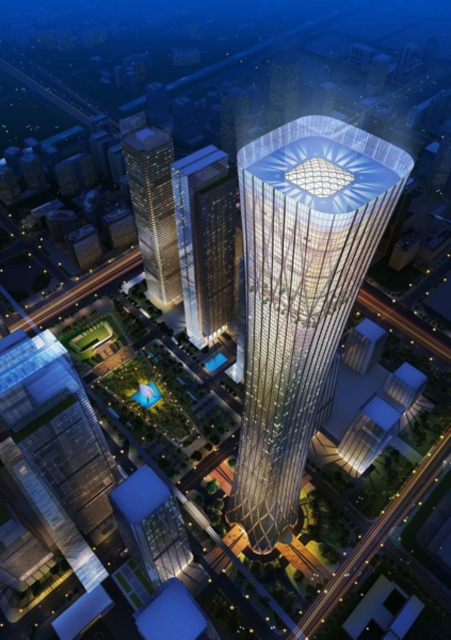
You are an architect evaluating the cityscape. Which of the two central towers, the gold glass tower at center or the transparent glass skyscraper at center, would you say is bigger in size?

The gold glass tower at center is larger in size compared to the transparent glass skyscraper at center.

You are standing at the center of the city square, which is located at point coordinates of 0.5, 0.5. You want to walk directly towards the gold glass tower at center. In which direction should you move from your current position?

You should move northeast because the gold glass tower at center is located at point coordinates of (300, 292), which is northeast of your current position at (225, 320).

In the scene shown: You are an architect analyzing the urban layout. Which of the two buildings, the gold glass tower at center or the gold glass skyscraper at left, is positioned higher in the image?

The gold glass skyscraper at left is positioned higher in the image because the gold glass tower at center is located below it.